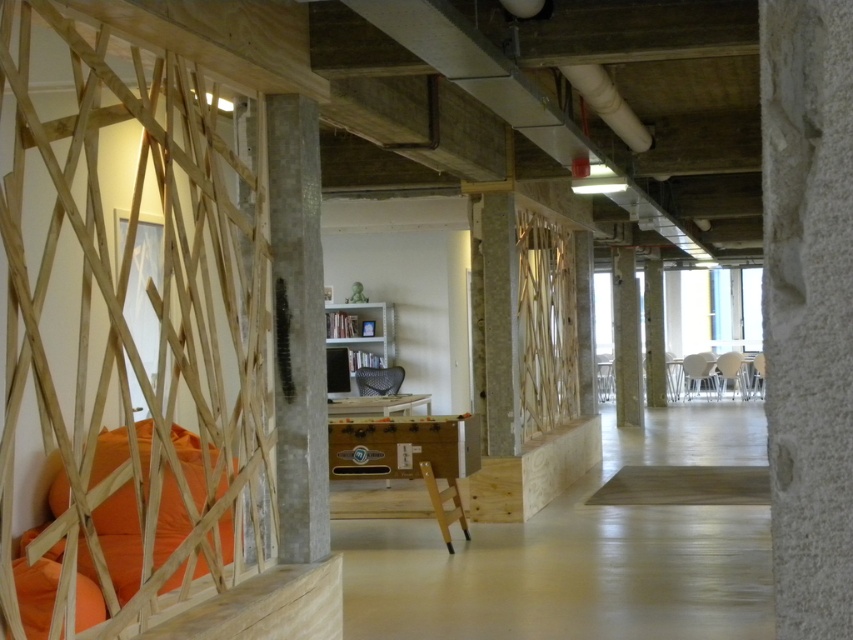
Question: Is orange fabric pillow at left closer to camera compared to concrete column at center?

Choices:
 (A) yes
 (B) no

Answer: (A)

Question: Does orange fabric pillow at lower left have a larger size compared to wooden ladder at center?

Choices:
 (A) yes
 (B) no

Answer: (B)

Question: Which of these objects is positioned closest to the wooden ladder at center?

Choices:
 (A) orange fabric pillow at left
 (B) concrete column at center

Answer: (A)

Question: Which object is the closest to the orange fabric pillow at lower left?

Choices:
 (A) orange fabric pillow at left
 (B) wooden ladder at center
 (C) gray concrete pillar at center
 (D) concrete column at center

Answer: (A)

Question: Is orange fabric pillow at lower left thinner than wooden ladder at center?

Choices:
 (A) no
 (B) yes

Answer: (A)

Question: Which object is the closest to the wooden ladder at center?

Choices:
 (A) concrete column at center
 (B) orange fabric pillow at lower left
 (C) gray concrete pillar at center

Answer: (C)